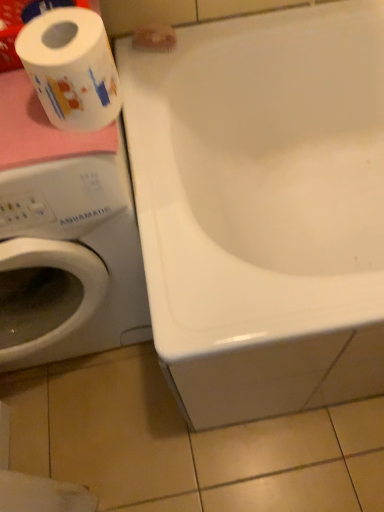
Question: From the image's perspective, is white matte toilet paper at upper center, the 2th toilet paper in the bottom-to-top sequence, positioned above or below white glossy bathtub at upper center?

Choices:
 (A) above
 (B) below

Answer: (A)

Question: Is white matte toilet paper at upper center, the 1th toilet paper from the top, spatially inside white glossy bathtub at upper center, or outside of it?

Choices:
 (A) outside
 (B) inside

Answer: (B)

Question: Which object is positioned farthest from the white glossy bathtub at upper center?

Choices:
 (A) white printed toilet paper at left, which is counted as the 1th toilet paper, starting from the front
 (B) white matte toilet paper at upper center, the 1th toilet paper from the top

Answer: (A)

Question: Based on their relative distances, which object is nearer to the white printed toilet paper at left, which is counted as the second toilet paper, starting from the top?

Choices:
 (A) white glossy bathtub at upper center
 (B) white matte toilet paper at upper center, the 1th toilet paper from the top

Answer: (B)